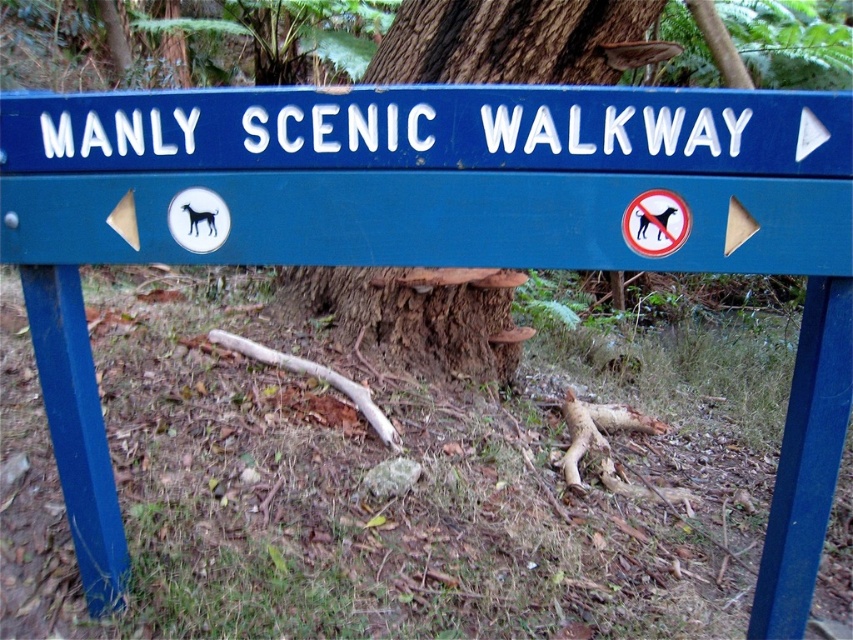
You are standing at the origin point in the forest. The blue painted wood sign at center is located at coordinates 0.275, 0.506. If you want to reach the sign, which direction should you move in relation to your current position?

Since the blue painted wood sign at center is located at coordinates (431, 176), you should move northeast to reach it from the origin point.

From the picture: You are standing in front of a signboard in a forest area. You see the blue painted metal sign at upper center and the brown rough bark at center. Which object is closer to you?

The blue painted metal sign at upper center is closer to the viewer than the brown rough bark at center.

You are planning to hang a new smaller sign next to the blue painted metal sign at upper center and the brown rough bark at center. Considering their sizes, which object can you place the new sign next to without overlapping?

The new smaller sign can be placed next to the brown rough bark at center since the blue painted metal sign at upper center is wider and may not have enough space for another sign without overlapping.